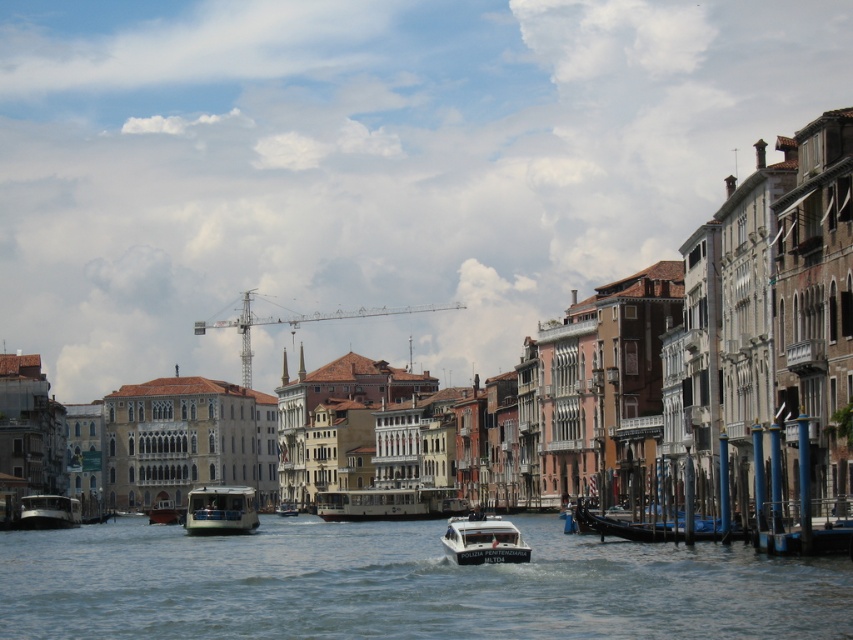
Which is in front, point (434, 515) or point (73, 524)?

Point (73, 524) is more forward.

Can you confirm if white matte/glossy boat at center is bigger than white glossy waterbus at lower left?

Indeed, white matte/glossy boat at center has a larger size compared to white glossy waterbus at lower left.

Does point (337, 506) come closer to viewer compared to point (61, 520)?

No, (337, 506) is behind (61, 520).

This screenshot has height=640, width=853. Identify the location of white matte/glossy boat at center. click(387, 502).

Can you confirm if green matte/glossy gondola at center is positioned below white glossy boat at center?

No, green matte/glossy gondola at center is not below white glossy boat at center.

Who is more distant from viewer, (206, 518) or (293, 504)?

The point (293, 504) is more distant.

Does point (227, 525) come in front of point (287, 502)?

Yes.

At what (x,y) coordinates should I click in order to perform the action: click on green matte/glossy gondola at center. Please return your answer as a coordinate pair (x, y). This screenshot has height=640, width=853. Looking at the image, I should click on (219, 509).

Which is below, clear water at center or white matte/glossy boat at center?

Positioned lower is white matte/glossy boat at center.

Is clear water at center thinner than white matte/glossy boat at center?

No.

Is point (195, 620) closer to viewer compared to point (409, 504)?

Yes.

Where is `clear water at center`? clear water at center is located at coordinates (403, 584).